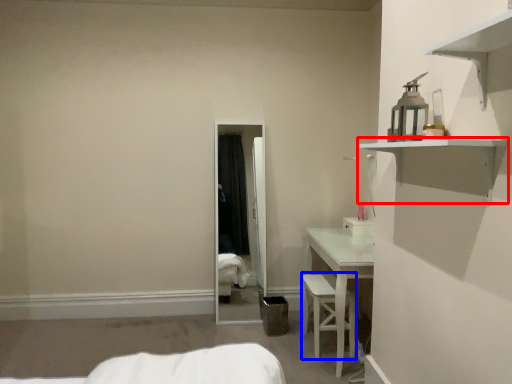
Question: Which object appears farthest to the camera in this image, shelf (highlighted by a red box) or armchair (highlighted by a blue box)?

Choices:
 (A) shelf
 (B) armchair

Answer: (B)